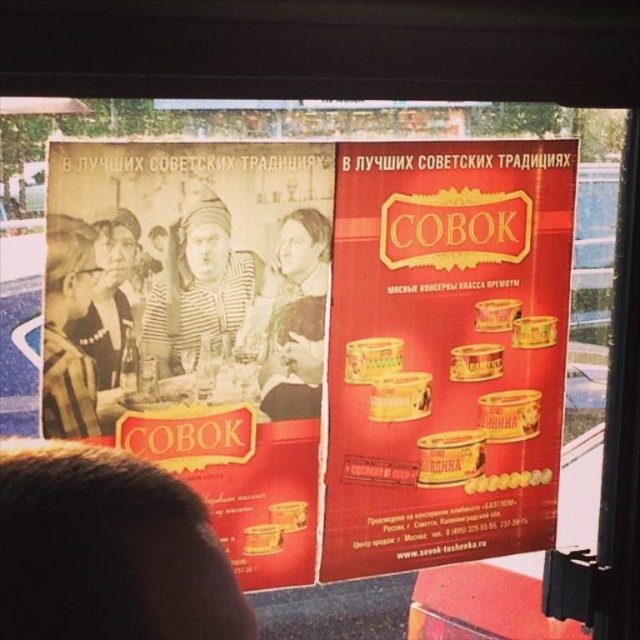
You are a painter standing in front of the red matte can at center and the sepia paper poster at center. You want to paint the taller object first. Which one should you choose?

The red matte can at center is much taller than the sepia paper poster at center, so you should paint the red matte can at center first.

You are an art student analyzing the poster. You notice the matte black headscarf at upper left and yellow matte can at lower right. How far apart are these two items in centimeters?

The matte black headscarf at upper left is 89.34 centimeters from the yellow matte can at lower right.